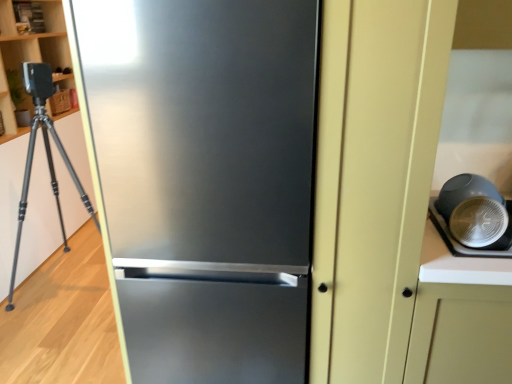
What is the approximate width of stainless steel refrigerator at center?

It is 23.64 inches.

Find the location of a particular element. The image size is (512, 384). stainless steel refrigerator at center is located at coordinates (206, 180).

This screenshot has height=384, width=512. What do you see at coordinates (206, 180) in the screenshot? I see `stainless steel refrigerator at center` at bounding box center [206, 180].

This screenshot has width=512, height=384. Find the location of `matte black bowl at right`. matte black bowl at right is located at coordinates (475, 213).

The width and height of the screenshot is (512, 384). What do you see at coordinates (475, 213) in the screenshot?
I see `matte black bowl at right` at bounding box center [475, 213].

Locate an element on the screen. The height and width of the screenshot is (384, 512). stainless steel refrigerator at center is located at coordinates coord(206,180).

Is stainless steel refrigerator at center to the right of matte black bowl at right from the viewer's perspective?

Incorrect, stainless steel refrigerator at center is not on the right side of matte black bowl at right.

Looking at this image, which object is closer to the camera, stainless steel refrigerator at center or matte black bowl at right?

stainless steel refrigerator at center is closer to the camera.

Does point (161, 125) come farther from viewer compared to point (501, 247)?

No, (161, 125) is closer to viewer.

From the image's perspective, which is above, stainless steel refrigerator at center or matte black bowl at right?

matte black bowl at right, from the image's perspective.

From a real-world perspective, between stainless steel refrigerator at center and matte black bowl at right, who is vertically higher?

In real-world perspective, matte black bowl at right is above.

Considering the sizes of stainless steel refrigerator at center and matte black bowl at right in the image, is stainless steel refrigerator at center wider or thinner than matte black bowl at right?

stainless steel refrigerator at center is wider than matte black bowl at right.

Consider the image. Can you confirm if stainless steel refrigerator at center is taller than matte black bowl at right?

Indeed, stainless steel refrigerator at center has a greater height compared to matte black bowl at right.

Between stainless steel refrigerator at center and matte black bowl at right, which one has smaller size?

With smaller size is matte black bowl at right.

Is stainless steel refrigerator at center positioned beyond the bounds of matte black bowl at right?

stainless steel refrigerator at center lies outside matte black bowl at right's area.

Is stainless steel refrigerator at center touching matte black bowl at right?

No, stainless steel refrigerator at center is not beside matte black bowl at right.

Is stainless steel refrigerator at center looking in the opposite direction of matte black bowl at right?

No, stainless steel refrigerator at center is not facing away from matte black bowl at right.

What's the angular difference between stainless steel refrigerator at center and matte black bowl at right's facing directions?

stainless steel refrigerator at center and matte black bowl at right are facing 91.1 degrees away from each other.

Measure the distance from stainless steel refrigerator at center to matte black bowl at right.

stainless steel refrigerator at center and matte black bowl at right are 29.26 inches apart.

The image size is (512, 384). In order to click on refrigerator on the left of the matte black bowl at right in this screenshot , I will do `click(206, 180)`.

Which object is positioned more to the left, matte black bowl at right or stainless steel refrigerator at center?

From the viewer's perspective, stainless steel refrigerator at center appears more on the left side.

Is matte black bowl at right positioned behind stainless steel refrigerator at center?

Yes, matte black bowl at right is further from the viewer.

Considering the points (486, 234) and (135, 381), which point is in front, point (486, 234) or point (135, 381)?

The point (486, 234) is in front.

From the image's perspective, is matte black bowl at right below stainless steel refrigerator at center?

Incorrect, from the image's perspective, matte black bowl at right is higher than stainless steel refrigerator at center.

From a real-world perspective, is matte black bowl at right physically located above or below stainless steel refrigerator at center?

Clearly, from a real-world perspective, matte black bowl at right is above stainless steel refrigerator at center.

Does matte black bowl at right have a lesser width compared to stainless steel refrigerator at center?

Indeed, matte black bowl at right has a lesser width compared to stainless steel refrigerator at center.

From the picture: Is matte black bowl at right shorter than stainless steel refrigerator at center?

Yes.

Considering the relative sizes of matte black bowl at right and stainless steel refrigerator at center in the image provided, is matte black bowl at right smaller than stainless steel refrigerator at center?

Indeed, matte black bowl at right has a smaller size compared to stainless steel refrigerator at center.

Is matte black bowl at right inside or outside of stainless steel refrigerator at center?

matte black bowl at right is not inside stainless steel refrigerator at center, it's outside.

Is there a large distance between matte black bowl at right and stainless steel refrigerator at center?

matte black bowl at right is actually quite close to stainless steel refrigerator at center.

Based on the photo, is matte black bowl at right oriented away from stainless steel refrigerator at center?

Yes, matte black bowl at right's orientation is away from stainless steel refrigerator at center.

What's the angular difference between matte black bowl at right and stainless steel refrigerator at center's facing directions?

They differ by 91.1 degrees in their facing directions.

What are the coordinates of `refrigerator that appears below the matte black bowl at right (from a real-world perspective)` in the screenshot? It's located at (206, 180).

At what (x,y) coordinates should I click in order to perform the action: click on refrigerator below the matte black bowl at right (from the image's perspective). Please return your answer as a coordinate pair (x, y). Image resolution: width=512 pixels, height=384 pixels. Looking at the image, I should click on (206, 180).

Where is `appliance above the stainless steel refrigerator at center (from a real-world perspective)`? The width and height of the screenshot is (512, 384). appliance above the stainless steel refrigerator at center (from a real-world perspective) is located at coordinates (475, 213).